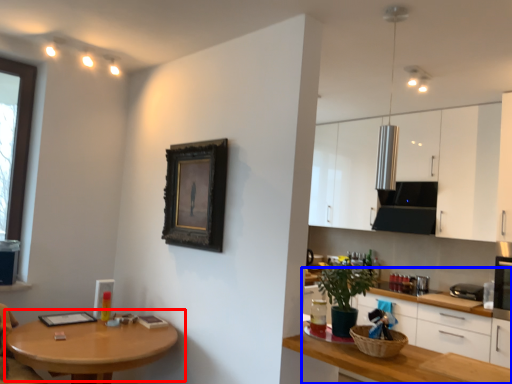
Question: Which of the following is the farthest to the observer, table (highlighted by a red box) or cabinetry (highlighted by a blue box)?

Choices:
 (A) table
 (B) cabinetry

Answer: (B)